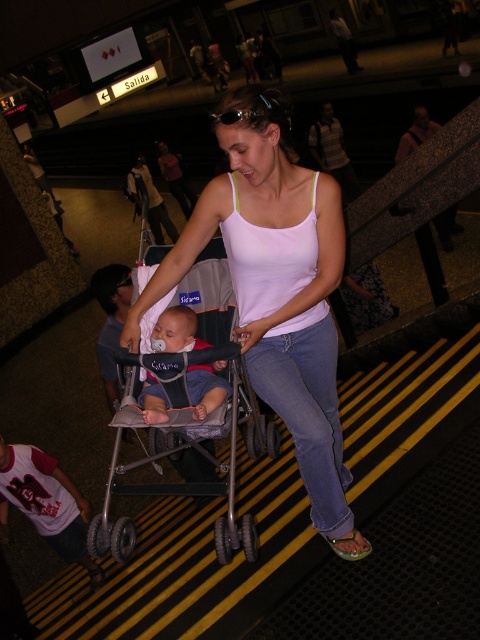
Measure the distance between gray fabric stroller at center and camera.

A distance of 2.39 meters exists between gray fabric stroller at center and camera.

Is gray fabric stroller at center wider than blue denim jeans at center?

Indeed, gray fabric stroller at center has a greater width compared to blue denim jeans at center.

Which is behind, point (219, 422) or point (300, 460)?

The point (219, 422) is more distant.

What are the coordinates of `gray fabric stroller at center` in the screenshot? It's located at (187, 413).

Is gray fabric stroller at center below white cotton shirt at lower left?

Incorrect, gray fabric stroller at center is not positioned below white cotton shirt at lower left.

Does gray fabric stroller at center lie behind white cotton shirt at lower left?

No, gray fabric stroller at center is closer to the viewer.

Which is behind, point (192, 280) or point (41, 534)?

Point (41, 534)

Locate an element on the screen. Image resolution: width=480 pixels, height=640 pixels. gray fabric stroller at center is located at coordinates (187, 413).

Between white cotton shirt at lower left and soft blue fabric baby at center, which one is positioned lower?

white cotton shirt at lower left is below.

Between white cotton shirt at lower left and soft blue fabric baby at center, which one appears on the right side from the viewer's perspective?

Positioned to the right is soft blue fabric baby at center.

The image size is (480, 640). What are the coordinates of `white cotton shirt at lower left` in the screenshot? It's located at (47, 502).